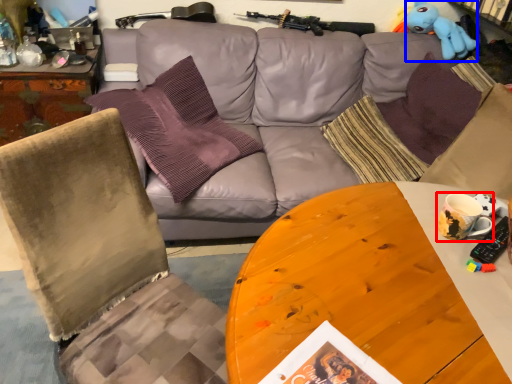
Question: Which point is further to the camera, coffee cup (highlighted by a red box) or toy (highlighted by a blue box)?

Choices:
 (A) coffee cup
 (B) toy

Answer: (B)